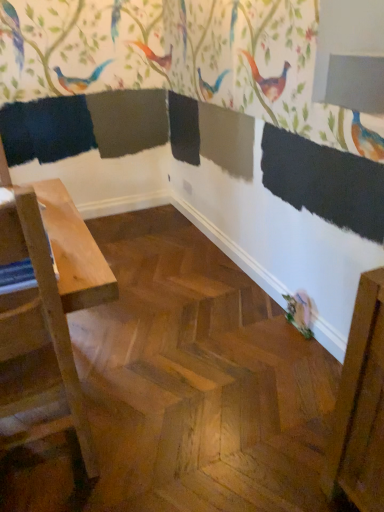
Question: In the image, is matte pink bird at lower right on the left side or the right side of light wood table at left?

Choices:
 (A) right
 (B) left

Answer: (A)

Question: Is point (297, 297) positioned closer to the camera than point (64, 343)?

Choices:
 (A) farther
 (B) closer

Answer: (A)

Question: In the image, is matte pink bird at lower right positioned in front of or behind light wood table at left?

Choices:
 (A) behind
 (B) front

Answer: (A)

Question: Considering the positions of light wood table at left and matte pink bird at lower right in the image, is light wood table at left wider or thinner than matte pink bird at lower right?

Choices:
 (A) thin
 (B) wide

Answer: (B)

Question: Based on their sizes in the image, would you say light wood table at left is bigger or smaller than matte pink bird at lower right?

Choices:
 (A) small
 (B) big

Answer: (B)

Question: Considering the positions of point (23, 196) and point (309, 300), is point (23, 196) closer or farther from the camera than point (309, 300)?

Choices:
 (A) farther
 (B) closer

Answer: (B)

Question: Is light wood table at left to the left or to the right of matte pink bird at lower right in the image?

Choices:
 (A) left
 (B) right

Answer: (A)